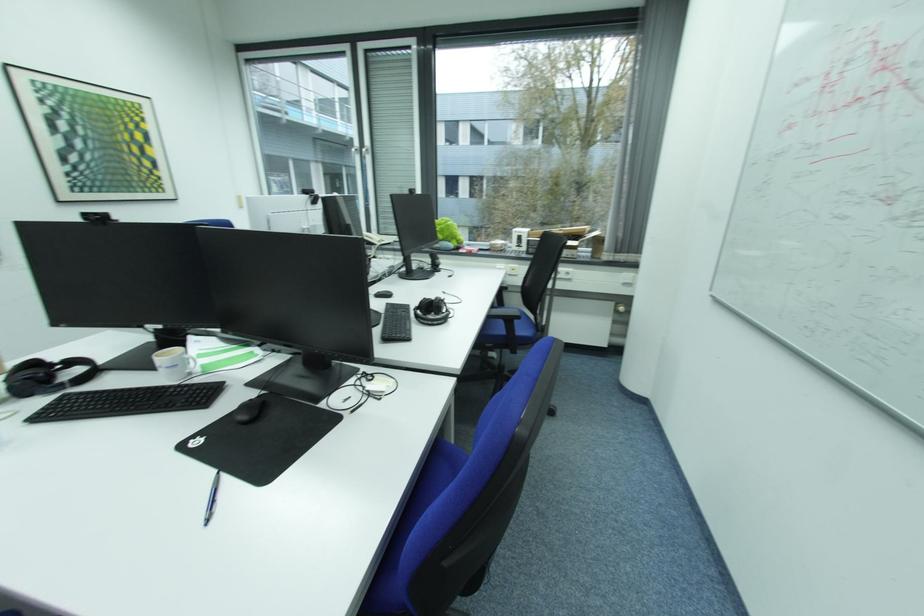
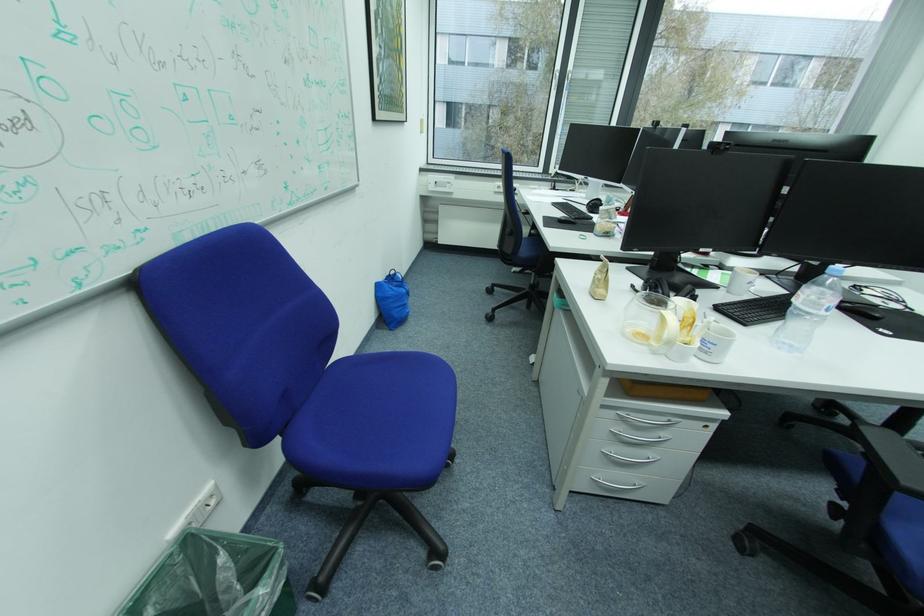
Question: The images are taken continuously from a first-person perspective. In which direction are you moving?

Choices:
 (A) Left
 (B) Right
 (C) Forward
 (D) Backward

Answer: (A)